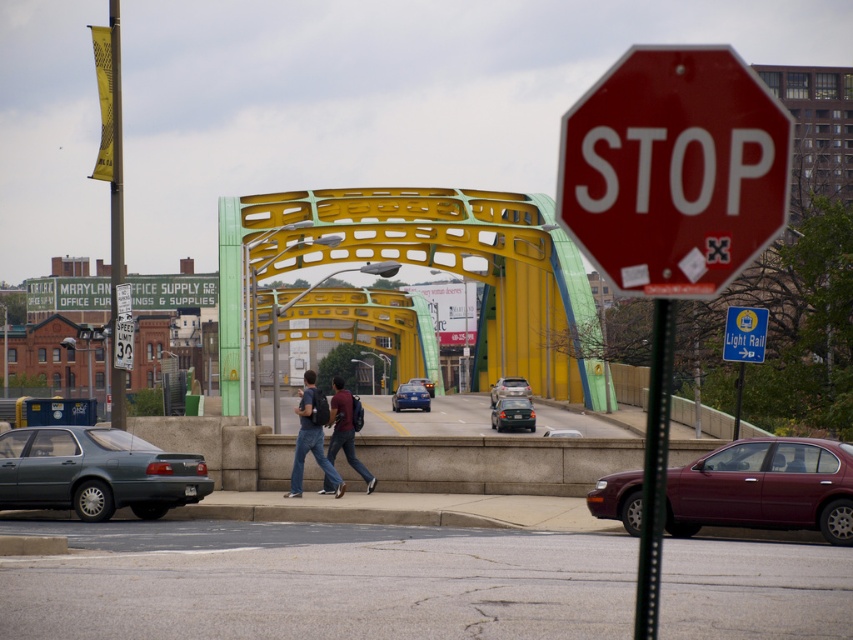
Question: Does red matte stop sign at upper right appear over metallic silver suv at center?

Choices:
 (A) no
 (B) yes

Answer: (B)

Question: Which object is positioned closest to the yellow fabric banner at left?

Choices:
 (A) dark blue jeans at center
 (B) matte gray sedan at lower left
 (C) maroon metallic sedan at lower right

Answer: (B)

Question: Which of the following is the closest to the observer?

Choices:
 (A) (753, 344)
 (B) (521, 394)
 (C) (656, 452)
 (D) (650, 74)

Answer: (D)

Question: Is the position of metallic pole at right less distant than that of matte black sedan at center?

Choices:
 (A) no
 (B) yes

Answer: (B)

Question: In this image, where is matte gray sedan at lower left located relative to yellow fabric banner at left?

Choices:
 (A) above
 (B) below

Answer: (B)

Question: Among these objects, which one is nearest to the camera?

Choices:
 (A) blue plastic sign at upper center
 (B) yellow-green painted metal pedestrian bridge at center
 (C) metallic silver sedan at center

Answer: (A)